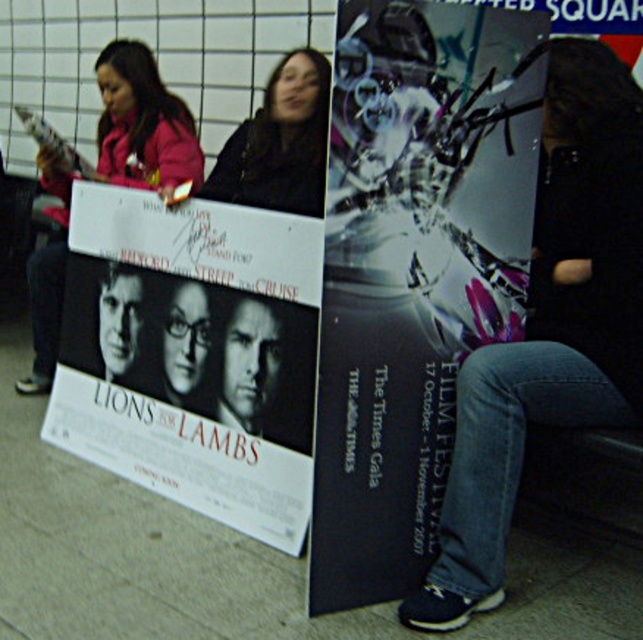
You are a photographer at the film festival event. You need to capture a photo that includes both the denim jeans at lower right and the black fabric jacket at center. Based on their positions, which object should you ensure is in the foreground of your photo?

The denim jeans at lower right should be in the foreground because it is below the black fabric jacket at center, meaning it is closer to the camera.

You are organizing a film festival and need to hang the white paper poster at center and the matte pink jacket at upper left. Based on their sizes, which object should you place first to ensure they fit properly?

The white paper poster at center is wider than the matte pink jacket at upper left, so you should hang the wider white paper poster at center first to ensure proper placement.

Please provide the 2D coordinates of the denim jeans at lower right in the image.

The denim jeans at lower right are located at the 2D coordinates of point (548,326).